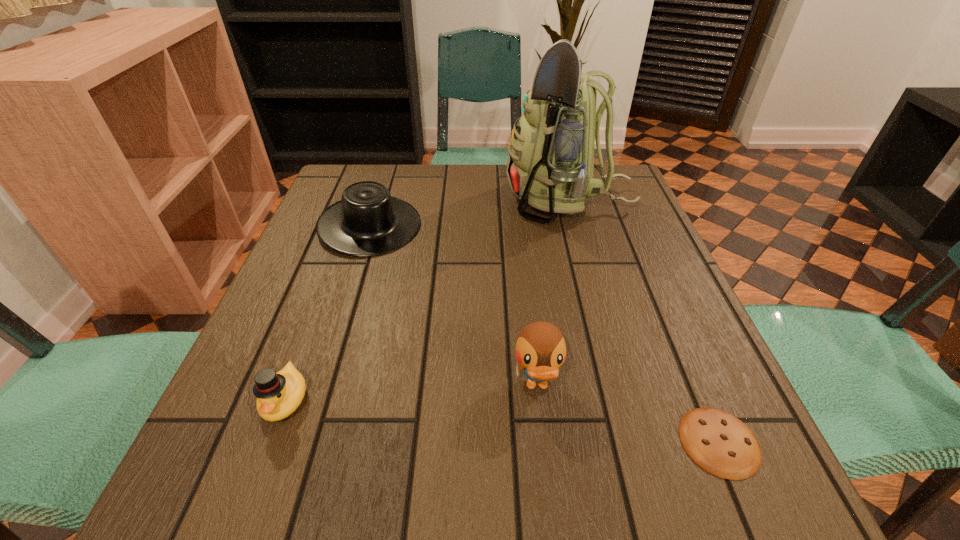
Find the location of a particular element. free space between the right duck and the cookie is located at coordinates (628, 414).

The height and width of the screenshot is (540, 960). I want to click on free spot between the backpack and the shortest object, so (644, 321).

I want to click on free space that is in between the dress hat and the taller duck, so click(453, 306).

Identify the location of free space between the shorter duck and the right duck. The width and height of the screenshot is (960, 540). (411, 393).

Image resolution: width=960 pixels, height=540 pixels. What are the coordinates of `free spot between the second tallest object and the dress hat` in the screenshot? It's located at (453, 306).

At what (x,y) coordinates should I click in order to perform the action: click on free space that is in between the tallest object and the taller duck. Please return your answer as a coordinate pair (x, y). Image resolution: width=960 pixels, height=540 pixels. Looking at the image, I should click on (553, 293).

Where is `vacant space in between the tallest object and the left duck`? The width and height of the screenshot is (960, 540). vacant space in between the tallest object and the left duck is located at coordinates (427, 300).

This screenshot has width=960, height=540. I want to click on empty location between the shorter duck and the fourth shortest object, so click(411, 393).

I want to click on the third closest object to the backpack, so click(x=721, y=444).

Select which object is the closest to the shorter duck. Please provide its 2D coordinates. Your answer should be formatted as a tuple, i.e. [(x, y)], where the tuple contains the x and y coordinates of a point satisfying the conditions above.

[(367, 221)]